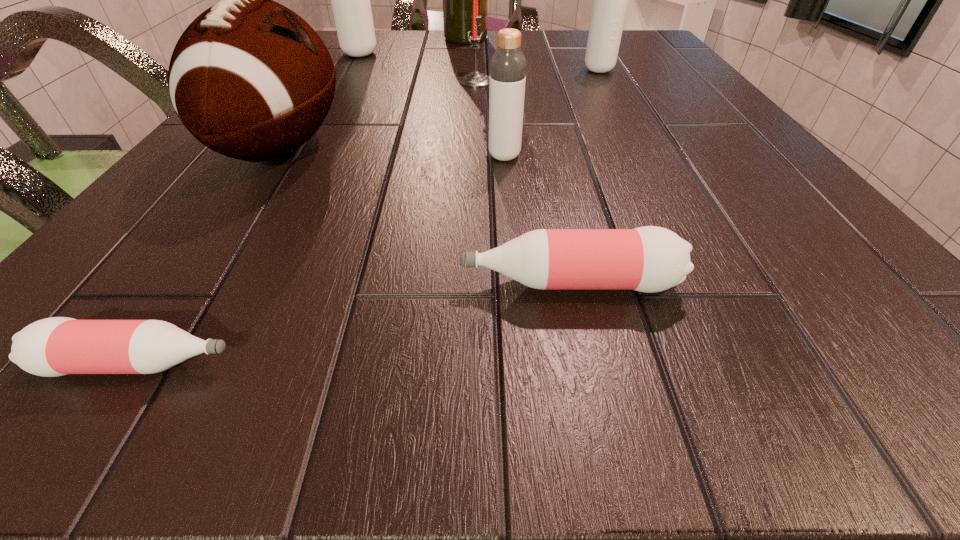
Identify the location of the fourth tallest bottle. (649, 259).

Locate an element on the screen. The height and width of the screenshot is (540, 960). the bigger pink bottle is located at coordinates (649, 259).

Locate an element on the screen. the smaller pink bottle is located at coordinates (56, 346).

Find the location of a particular element. The height and width of the screenshot is (540, 960). the nearer pink bottle is located at coordinates (56, 346).

At what (x,y) coordinates should I click in order to perform the action: click on free space located on the front-facing side of the wine bottle. Please return your answer as a coordinate pair (x, y). Image resolution: width=960 pixels, height=540 pixels. Looking at the image, I should click on [x=546, y=38].

You are a GUI agent. You are given a task and a screenshot of the screen. Output one action in this format:
    pyautogui.click(x=<x>, y=<y>)
    Task: Click on the blank area located on the back of the leftmost gray bottle
    This screenshot has width=960, height=540.
    Given the screenshot: What is the action you would take?
    pos(373,30)

Identify the location of free location located 0.200m on the left of the second smallest gray bottle. The width and height of the screenshot is (960, 540). (492, 70).

Identify the location of vacant space located 0.160m on the right of the football (American). (445, 147).

At what (x,y) coordinates should I click in order to perform the action: click on vacant space situated 0.350m on the back of the third farthest bottle. Please return your answer as a coordinate pair (x, y). The image size is (960, 540). Looking at the image, I should click on (497, 71).

This screenshot has height=540, width=960. I want to click on vacant position located 0.170m on the front-facing side of the candle, so click(574, 82).